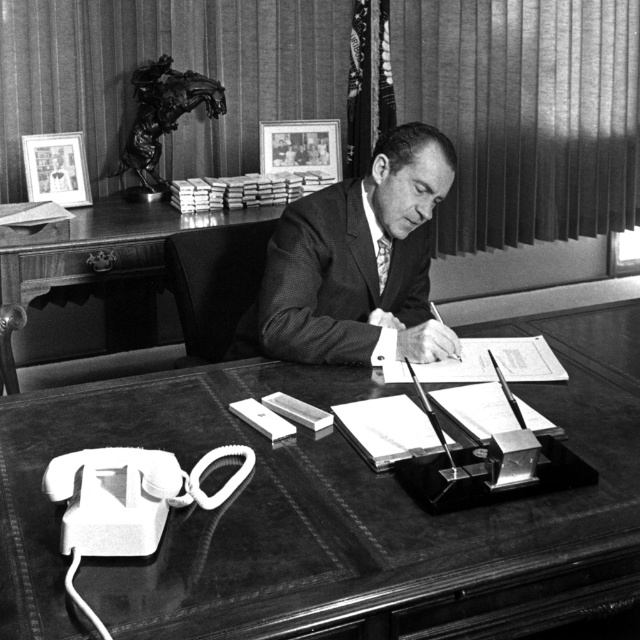
You are an office assistant who needs to place a new item on the desk. The desk has a leather at center. Where exactly should you place the new item to ensure it is centered on the desk?

The leather at center is located at coordinates point (332, 509), so placing the new item at those coordinates would center it on the desk.

What is the exact 2D coordinate of the leather at center in the image?

The exact 2D coordinate of the leather at center is at point [332,509].

Based on the scene description, where is the smooth suit at center located in relation to the wooden desk at center?

The smooth suit at center is to the right of the wooden desk at center.